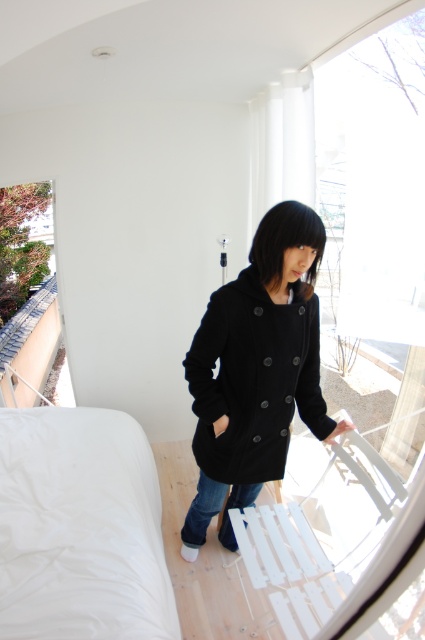
Question: Is white soft bed at lower left bigger than black woolen coat at center?

Choices:
 (A) no
 (B) yes

Answer: (B)

Question: Which of the following is the farthest from the observer?

Choices:
 (A) black woolen coat at center
 (B) white soft bed at lower left

Answer: (A)

Question: Does white soft bed at lower left have a lesser width compared to black woolen coat at center?

Choices:
 (A) no
 (B) yes

Answer: (A)

Question: Can you confirm if white soft bed at lower left is bigger than black woolen coat at center?

Choices:
 (A) no
 (B) yes

Answer: (B)

Question: Among these points, which one is farthest from the camera?

Choices:
 (A) (65, 589)
 (B) (220, 456)

Answer: (B)